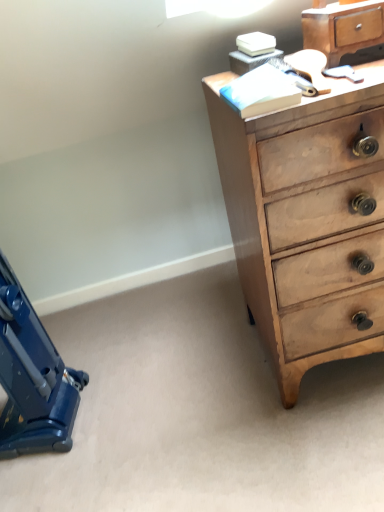
Locate an element on the screen. The image size is (384, 512). space that is in front of blue plastic vacuum cleaner at lower left is located at coordinates pos(56,478).